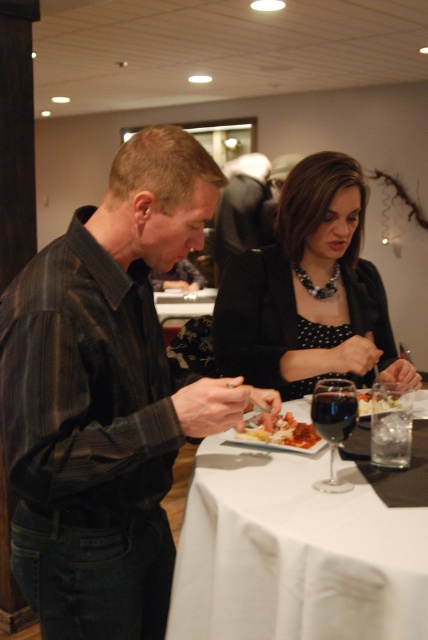
You are a server in a restaurant. You need to place a new menu that is 1.2 times wider than the dark glass at table center. Can the menu fit next to the black striped shirt at center without overlapping?

The black striped shirt at center is wider than the dark glass at table center. Since the menu is 1.2 times wider than the dark glass, it would be wider than the shirt. Therefore, the menu cannot fit next to the black striped shirt at center without overlapping.

You are a waiter in a restaurant. You need to place a new drink order for the customer wearing the black striped shirt at center. Where should you place the drink relative to the dark glass at table center?

The black striped shirt at center is in front of the dark glass at table center, so you should place the drink behind the dark glass at table center to ensure it is accessible to the customer.